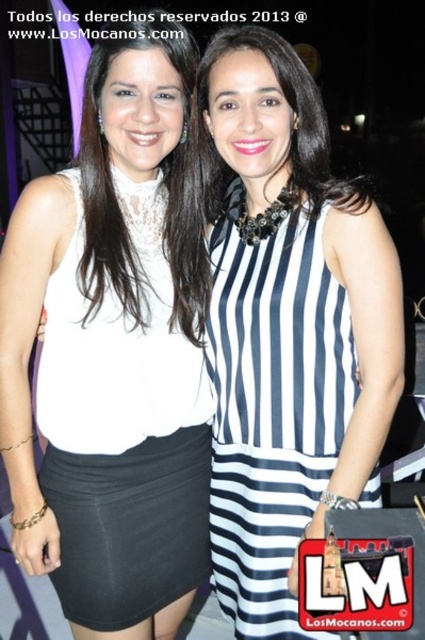
Question: Can you confirm if white lace dress at left is wider than navy blue striped dress at center?

Choices:
 (A) yes
 (B) no

Answer: (A)

Question: Among these points, which one is farthest from the camera?

Choices:
 (A) (323, 394)
 (B) (204, 474)

Answer: (B)

Question: Which of the following is the farthest from the observer?

Choices:
 (A) (110, 627)
 (B) (266, 512)

Answer: (B)

Question: Does white lace dress at left have a smaller size compared to navy blue striped dress at center?

Choices:
 (A) no
 (B) yes

Answer: (B)

Question: From the image, what is the correct spatial relationship of white lace dress at left in relation to navy blue striped dress at center?

Choices:
 (A) below
 (B) above

Answer: (B)